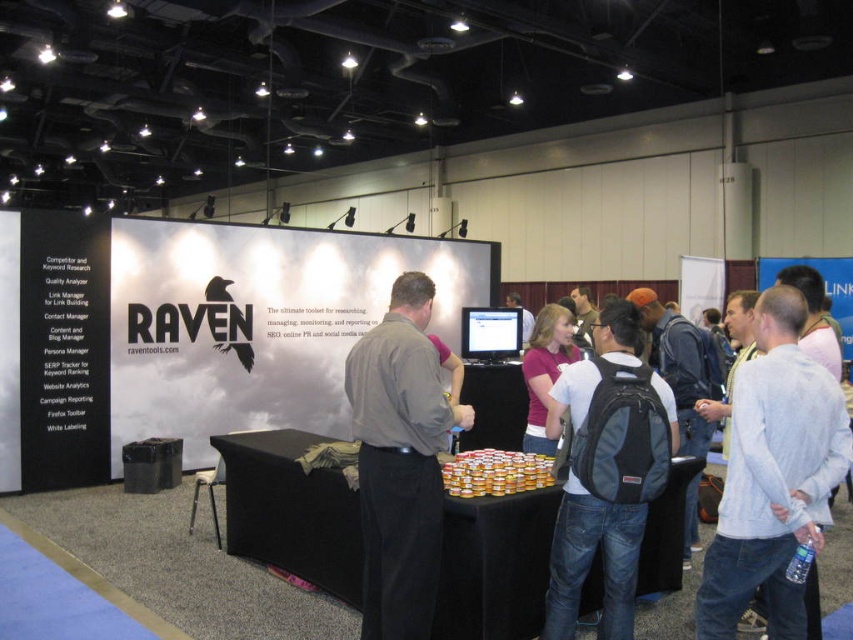
You are standing at the entrance of the trade show and see the RAVEN booth with its white backdrop. There is a point marked at coordinates (x=587, y=557). Based on the scene description, where is this point located?

The point at (x=587, y=557) is located on denim jeans at center.

You are a photographer standing at the center of the trade show floor. You want to take a photo of the gray cotton shirt at right without moving your position. Is the camera within reach to capture the shirt?

The gray cotton shirt at right and camera are 2.39 meters apart. Since the photographer is standing at the center of the trade show floor, the camera is 2.39 meters away from the shirt. However, without knowing the camera lens focal length or zoom capabilities, it is impossible to determine if the camera can capture the shirt from that distance.